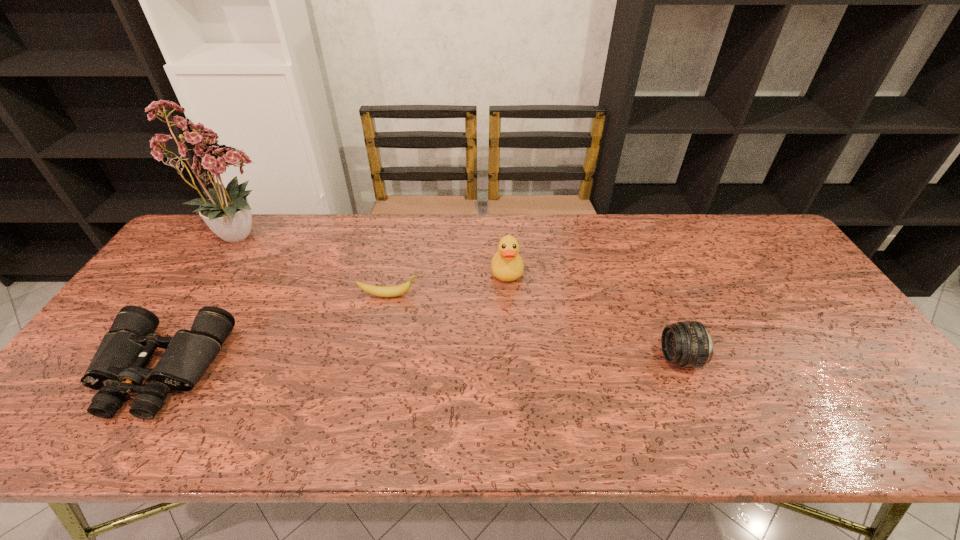
Where is `object located in the far left corner section of the desktop`? object located in the far left corner section of the desktop is located at coordinates (227, 213).

You are a GUI agent. You are given a task and a screenshot of the screen. Output one action in this format:
    pyautogui.click(x=<x>, y=<y>)
    Task: Click on the object present at the near left corner
    
    Given the screenshot: What is the action you would take?
    [117, 368]

This screenshot has height=540, width=960. Find the location of `blank space at the far edge of the desktop`. blank space at the far edge of the desktop is located at coordinates pyautogui.click(x=404, y=255).

Find the location of a particular element. free space at the near edge of the desktop is located at coordinates (406, 443).

Locate an element on the screen. vacant space at the left edge of the desktop is located at coordinates (75, 403).

In the image, there is a desktop. Where is `vacant area at the right edge`? The height and width of the screenshot is (540, 960). vacant area at the right edge is located at coordinates (791, 272).

You are a GUI agent. You are given a task and a screenshot of the screen. Output one action in this format:
    pyautogui.click(x=<x>, y=<y>)
    Task: Click on the vacant space at the far right corner
    
    Given the screenshot: What is the action you would take?
    pyautogui.click(x=772, y=242)

The image size is (960, 540). What are the coordinates of `empty space that is in between the fourth shortest object and the third nearest object` in the screenshot? It's located at [448, 284].

You are a GUI agent. You are given a task and a screenshot of the screen. Output one action in this format:
    pyautogui.click(x=<x>, y=<y>)
    Task: Click on the free space between the farthest object and the duck
    
    Given the screenshot: What is the action you would take?
    pyautogui.click(x=374, y=253)

Where is `free spot between the rightmost object and the flower arrangement`? The image size is (960, 540). free spot between the rightmost object and the flower arrangement is located at coordinates (461, 296).